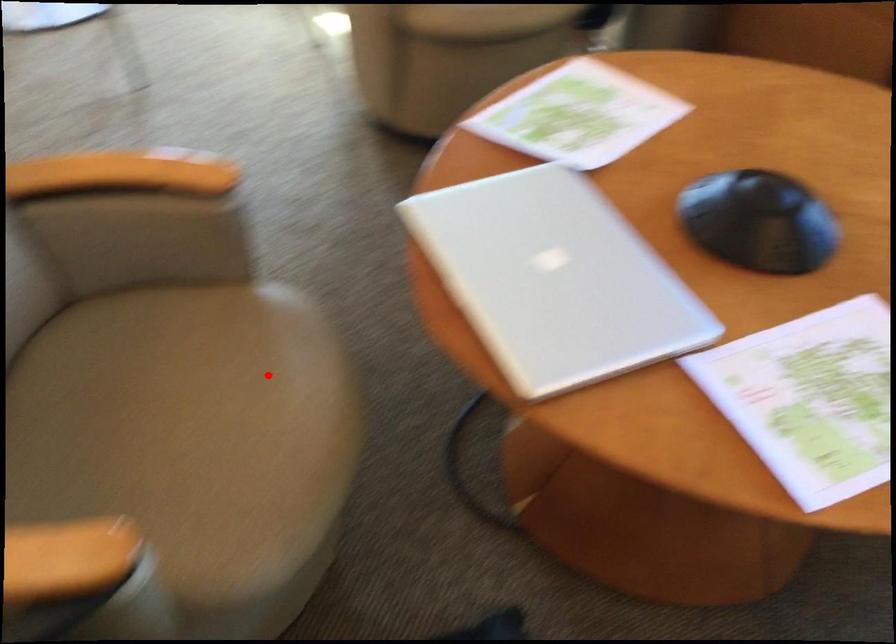
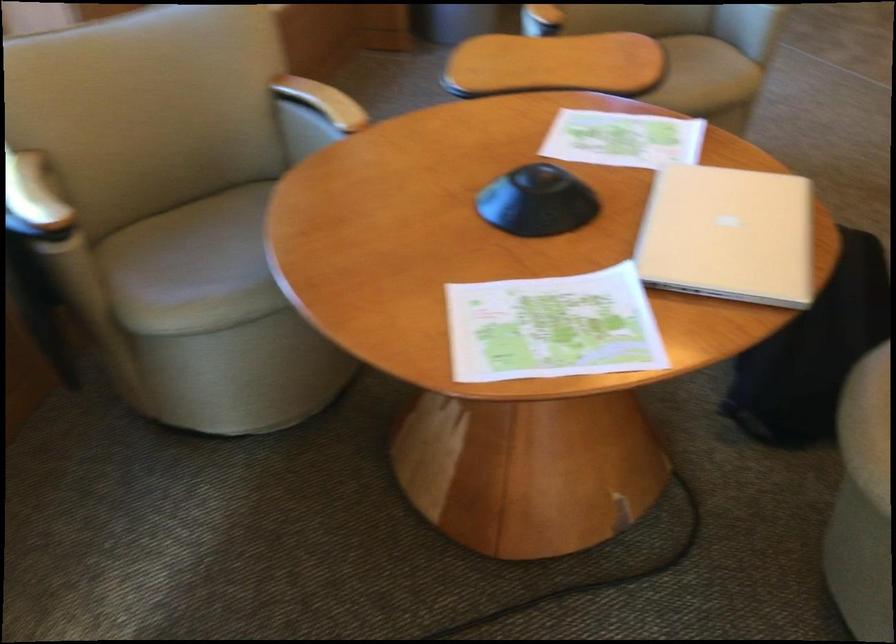
The point at the highlighted location is marked in the first image. Where is the corresponding point in the second image?

(867, 426)